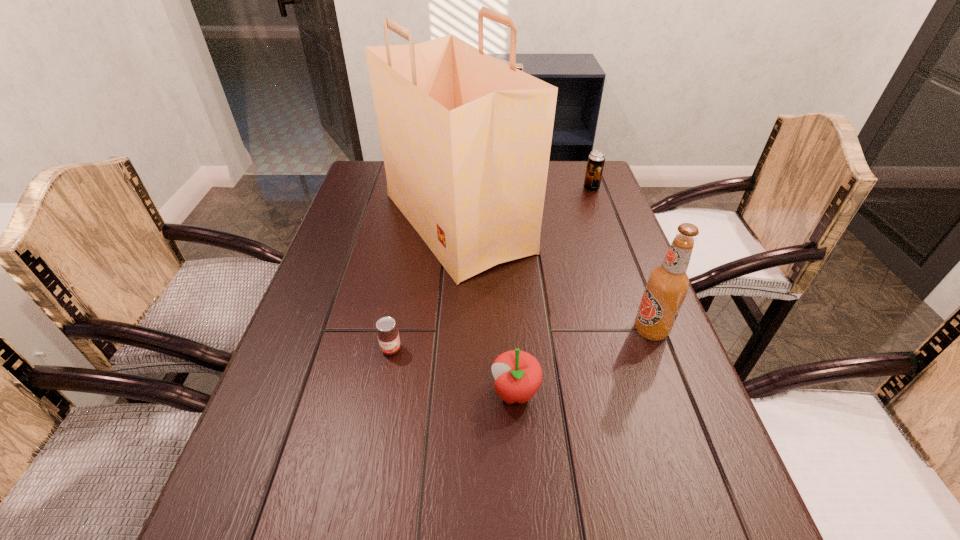
You are a GUI agent. You are given a task and a screenshot of the screen. Output one action in this format:
    pyautogui.click(x=<x>, y=<y>)
    Task: Click on the vacant space at the right edge of the desktop
    
    Given the screenshot: What is the action you would take?
    pyautogui.click(x=612, y=205)

The width and height of the screenshot is (960, 540). Find the location of `free spot at the far right corner of the desktop`. free spot at the far right corner of the desktop is located at coordinates (571, 160).

The image size is (960, 540). What are the coordinates of `free spot between the shortest object and the beer bottle` in the screenshot? It's located at (521, 340).

Find the location of a particular element. vacant space in between the beer can and the beer bottle is located at coordinates (621, 260).

Where is `free spot between the beer can and the nearest object`? Image resolution: width=960 pixels, height=540 pixels. free spot between the beer can and the nearest object is located at coordinates (553, 291).

Locate an element on the screen. The height and width of the screenshot is (540, 960). free space between the beer can and the apple is located at coordinates (x=553, y=291).

Image resolution: width=960 pixels, height=540 pixels. Identify the location of vacant area that lies between the nearest object and the beer bottle. (583, 362).

The width and height of the screenshot is (960, 540). I want to click on free spot between the beer bottle and the tallest object, so click(x=554, y=276).

Where is `vacant area that lies between the grocery bag and the jam`? The image size is (960, 540). vacant area that lies between the grocery bag and the jam is located at coordinates (424, 286).

Where is `vacant space that's between the tallest object and the shortest object`? Image resolution: width=960 pixels, height=540 pixels. vacant space that's between the tallest object and the shortest object is located at coordinates (424, 286).